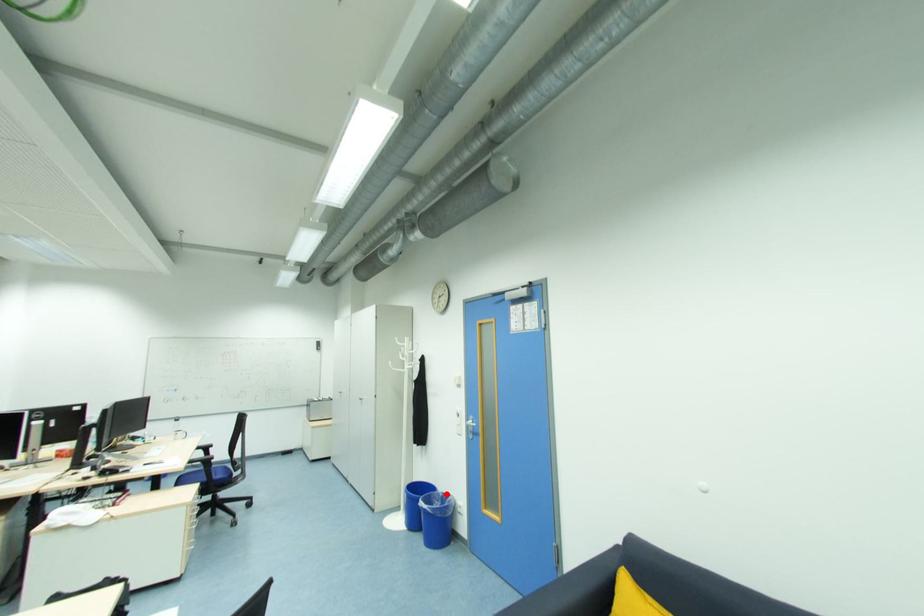
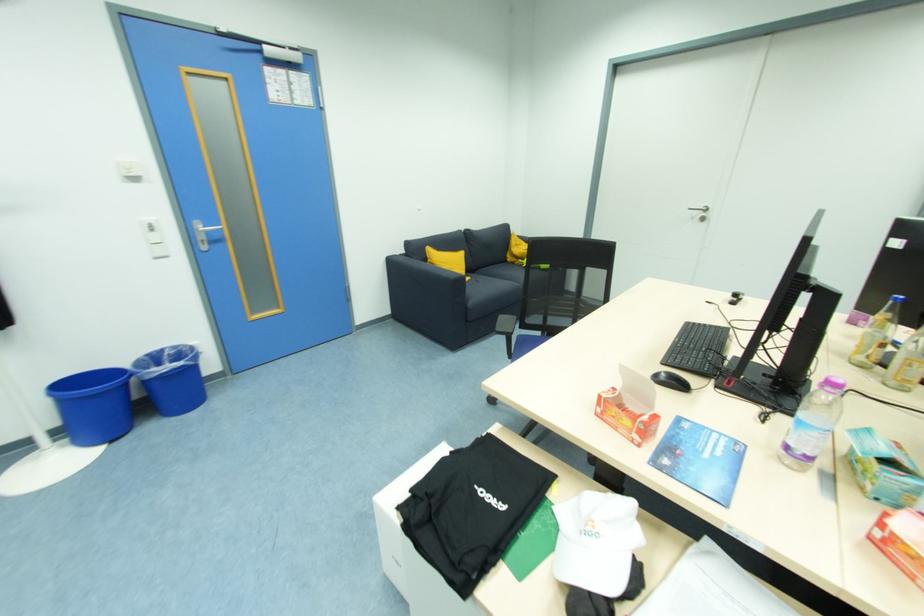
Locate, in the second image, the point that corresponds to the highlighted location in the first image.

(151, 357)